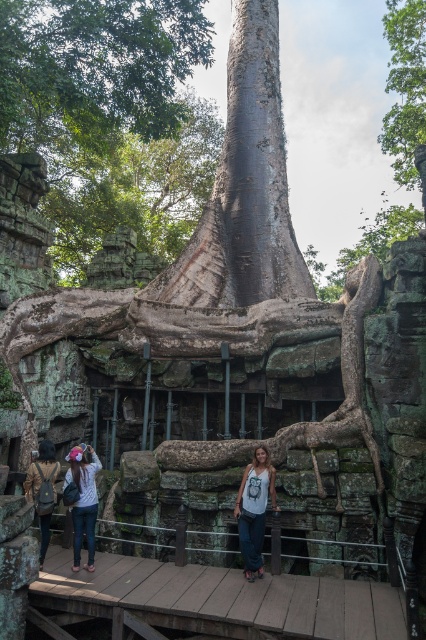
You are a hiker who has just arrived at this ancient site. You notice the green rough bark tree at upper right and the denim pants at lower left. Which object is positioned more to the east?

The green rough bark tree at upper right is to the right of denim pants at lower left, so the tree is positioned more to the east.